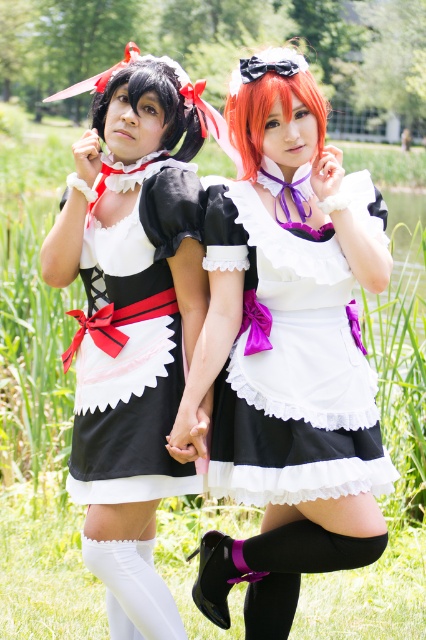
You are a photographer trying to capture the white satin dress at center and the matte black dress at left in a single shot. Based on their positions, which dress will appear closer to the camera in the photo?

The white satin dress at center will appear closer to the camera because it is positioned in front of the matte black dress at left.